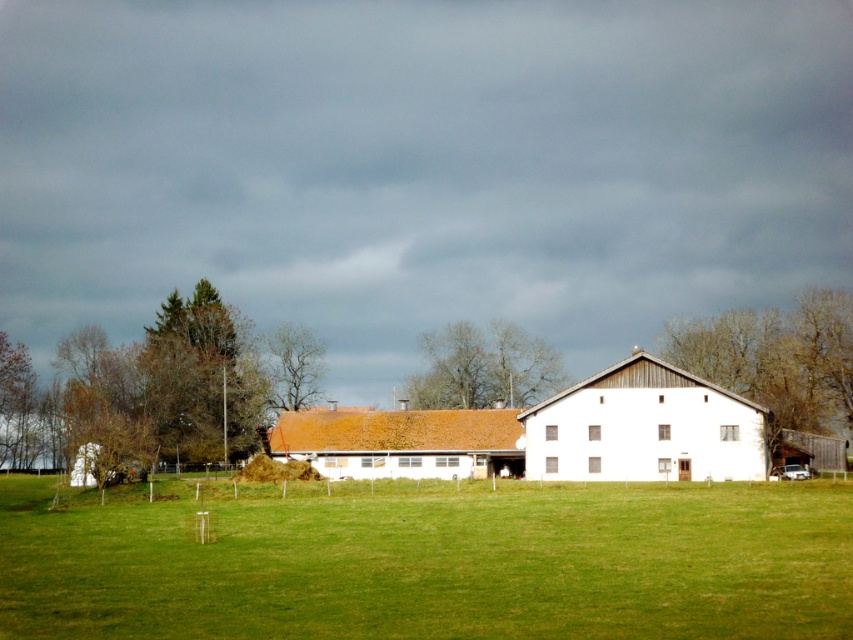
Question: Which object appears closest to the camera in this image?

Choices:
 (A) white wood barn at center
 (B) brown textured tree at center

Answer: (A)

Question: Which point appears farthest from the camera in this image?

Choices:
 (A) (254, 541)
 (B) (752, 348)
 (C) (700, 384)

Answer: (B)

Question: Is brown wood tree at center to the right of bare branches at upper center from the viewer's perspective?

Choices:
 (A) no
 (B) yes

Answer: (B)

Question: Is green textured tree at left smaller than brown textured tree at center?

Choices:
 (A) yes
 (B) no

Answer: (B)

Question: Is green grassy field at center positioned at the back of brown shingle roof at center?

Choices:
 (A) no
 (B) yes

Answer: (A)

Question: Which point is closer to the camera?

Choices:
 (A) (450, 371)
 (B) (434, 413)
 (C) (172, 323)

Answer: (B)